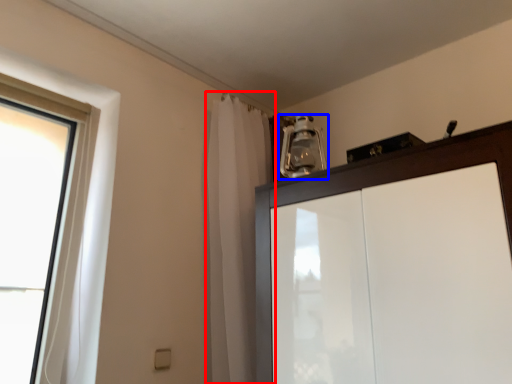
Question: Among these objects, which one is farthest to the camera, shower curtain (highlighted by a red box) or light fixture (highlighted by a blue box)?

Choices:
 (A) shower curtain
 (B) light fixture

Answer: (B)